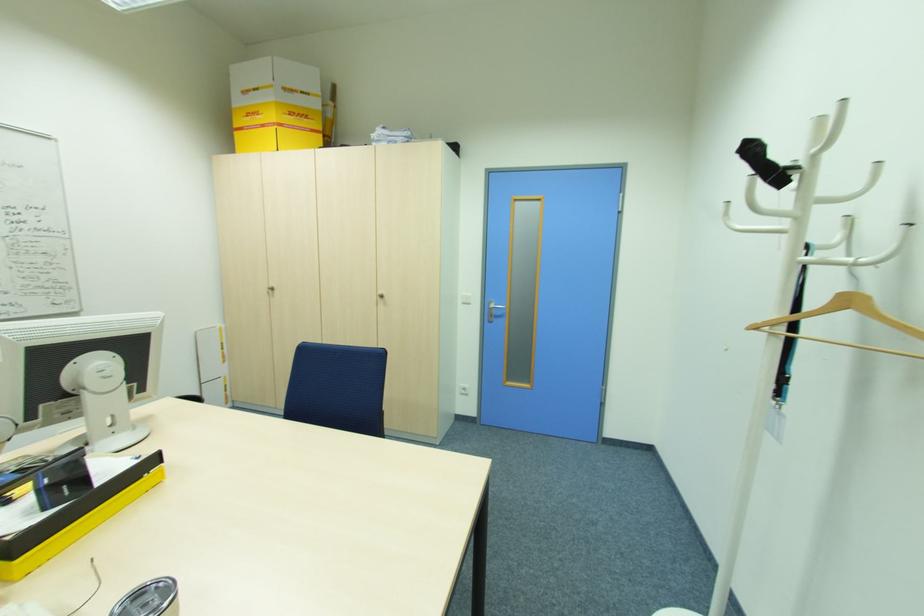
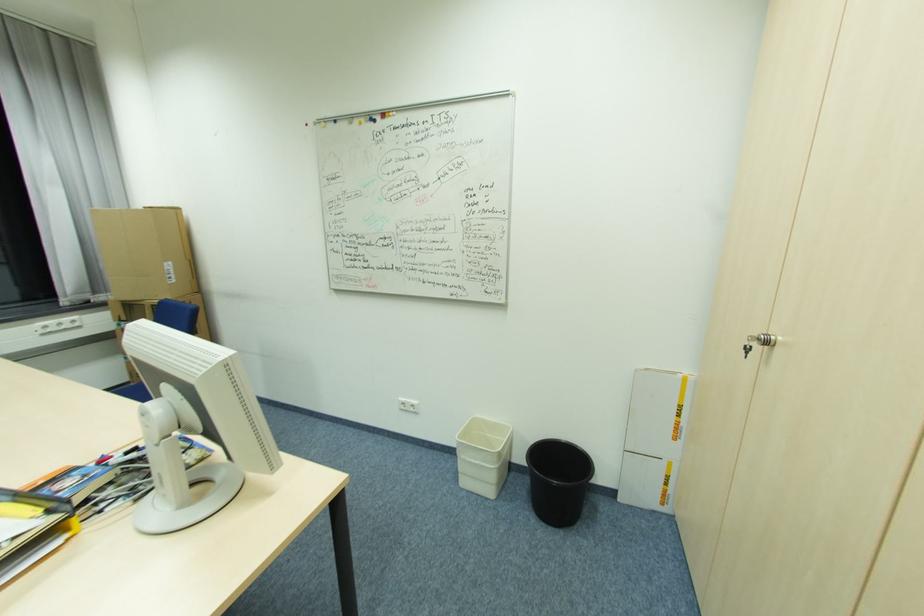
Find the pixel in the second image that matches point (162, 322) in the first image.

(207, 371)